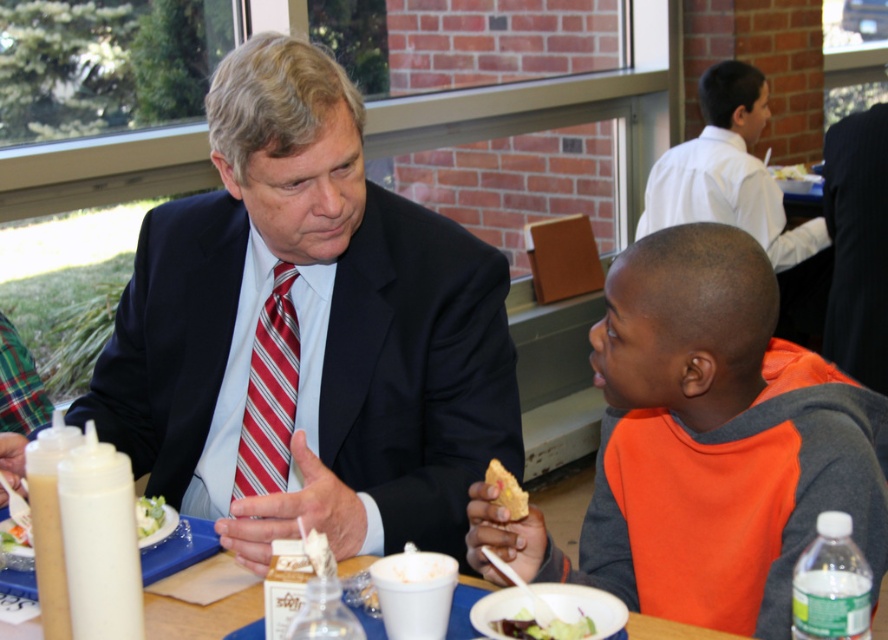
Question: Which object appears farthest from the camera in this image?

Choices:
 (A) white shirt at upper right
 (B) green leafy salad at lower center
 (C) dark blue suit at right

Answer: (A)

Question: Is the position of matte black suit at center less distant than that of yellow crumbly bread at lower center?

Choices:
 (A) no
 (B) yes

Answer: (A)

Question: Among these objects, which one is farthest from the camera?

Choices:
 (A) dark blue suit at right
 (B) white shirt at upper right
 (C) blue plastic table at center
 (D) golden brown bread at center

Answer: (D)

Question: Which point is closer to the camera?

Choices:
 (A) (875, 490)
 (B) (268, 339)

Answer: (A)

Question: In this image, where is red striped tie at center located relative to green leafy salad at lower center?

Choices:
 (A) left
 (B) right

Answer: (A)

Question: Does matte black suit at center have a greater width compared to orange fleece jacket at lower right?

Choices:
 (A) no
 (B) yes

Answer: (B)